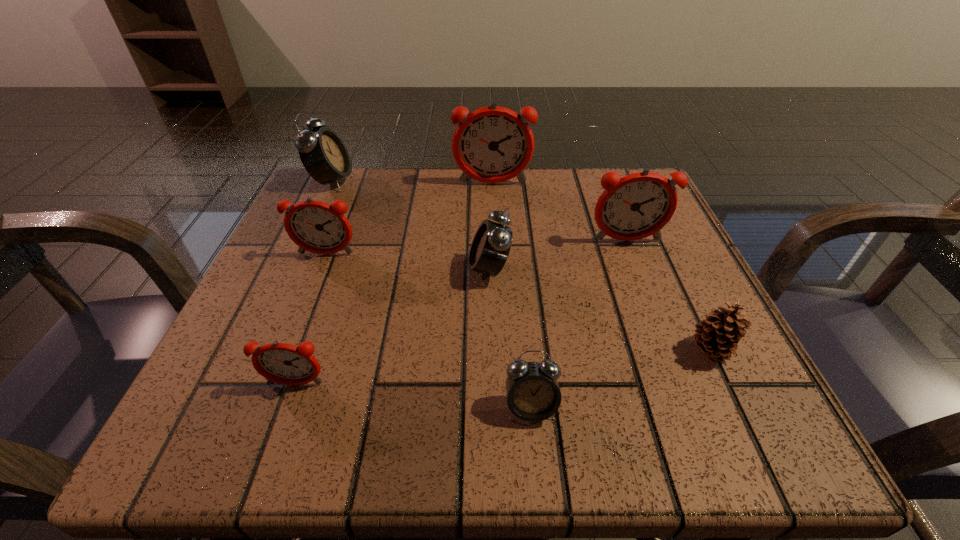
Identify which alarm clock is the sixth nearest to the smallest white alarm clock. Please provide its 2D coordinates. Your answer should be formatted as a tuple, i.e. [(x, y)], where the tuple contains the x and y coordinates of a point satisfying the conditions above.

[(323, 154)]

Choose which reddish-pink alarm clock is the third nearest neighbor to the farthest reddish-pink alarm clock. Please provide its 2D coordinates. Your answer should be formatted as a tuple, i.e. [(x, y)], where the tuple contains the x and y coordinates of a point satisfying the conditions above.

[(286, 364)]

Identify the location of the third closest reddish-pink alarm clock to the second biggest white alarm clock. The width and height of the screenshot is (960, 540). (493, 144).

Where is `white alarm clock that is the closest to the second smallest reddish-pink alarm clock`? The image size is (960, 540). white alarm clock that is the closest to the second smallest reddish-pink alarm clock is located at coordinates (323, 154).

Locate which white alarm clock ranks in proximity to the smallest white alarm clock. Please provide its 2D coordinates. Your answer should be formatted as a tuple, i.e. [(x, y)], where the tuple contains the x and y coordinates of a point satisfying the conditions above.

[(490, 248)]

Where is `free space that satisfies the following two spatial constraints: 1. on the face of the second smallest white alarm clock; 2. on the front-facing side of the smallest reddish-pink alarm clock`? Image resolution: width=960 pixels, height=540 pixels. free space that satisfies the following two spatial constraints: 1. on the face of the second smallest white alarm clock; 2. on the front-facing side of the smallest reddish-pink alarm clock is located at coordinates (492, 384).

You are a GUI agent. You are given a task and a screenshot of the screen. Output one action in this format:
    pyautogui.click(x=<x>, y=<y>)
    Task: Click on the blank area in the image that satisfies the following two spatial constraints: 1. on the front-facing side of the sixth farthest object; 2. on the right side of the second biggest reddish-pink alarm clock
    Image resolution: width=960 pixels, height=540 pixels.
    Given the screenshot: What is the action you would take?
    pyautogui.click(x=670, y=350)

Where is `free space that satisfies the following two spatial constraints: 1. on the face of the second farthest white alarm clock; 2. on the front-facing side of the nearest reddish-pink alarm clock`? The height and width of the screenshot is (540, 960). free space that satisfies the following two spatial constraints: 1. on the face of the second farthest white alarm clock; 2. on the front-facing side of the nearest reddish-pink alarm clock is located at coordinates (492, 384).

This screenshot has width=960, height=540. Identify the location of vacant space that satisfies the following two spatial constraints: 1. on the face of the second smallest white alarm clock; 2. on the back side of the pinecone. (491, 350).